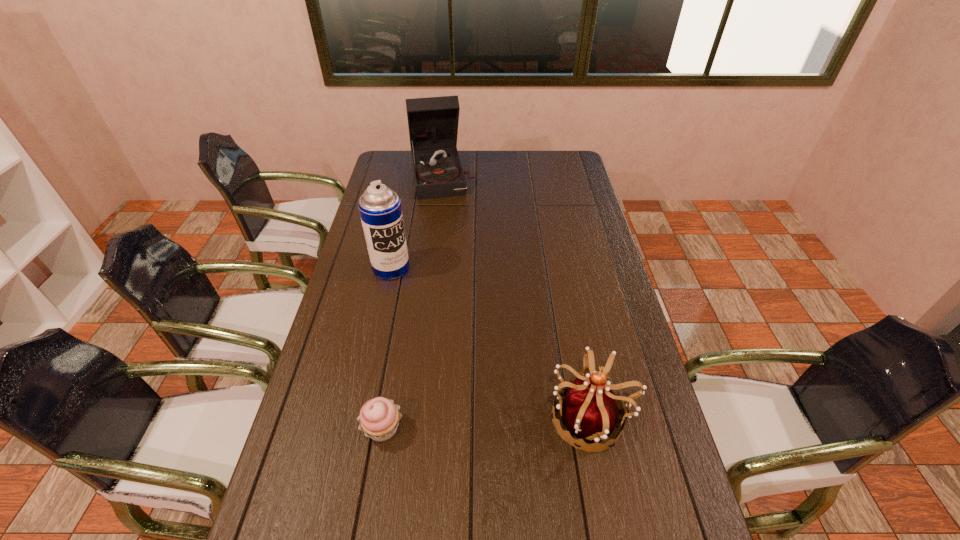
This screenshot has height=540, width=960. What are the coordinates of `cupcake` in the screenshot? It's located at (379, 418).

Find the location of a particular element. The height and width of the screenshot is (540, 960). tiara is located at coordinates (590, 410).

At what (x,y) coordinates should I click in order to perform the action: click on the rightmost object. Please return your answer as a coordinate pair (x, y). Looking at the image, I should click on (590, 410).

You are a GUI agent. You are given a task and a screenshot of the screen. Output one action in this format:
    pyautogui.click(x=<x>, y=<y>)
    Task: Click on the aerosol can
    The image size is (960, 540).
    Given the screenshot: What is the action you would take?
    pyautogui.click(x=380, y=210)

Locate an element on the screen. The image size is (960, 540). the farthest object is located at coordinates (433, 122).

At what (x,y) coordinates should I click in order to perform the action: click on vacant space located on the right of the shortest object. Please return your answer as a coordinate pair (x, y). Looking at the image, I should click on pyautogui.click(x=515, y=428).

This screenshot has width=960, height=540. In order to click on free space located on the front-facing side of the tiara in this screenshot , I will do `click(452, 417)`.

I want to click on free spot located 0.110m on the front-facing side of the tiara, so click(506, 417).

Locate an element on the screen. The width and height of the screenshot is (960, 540). vacant area situated 0.240m on the front-facing side of the tiara is located at coordinates (456, 417).

I want to click on vacant region located 0.180m on the label side of the third nearest object, so click(425, 311).